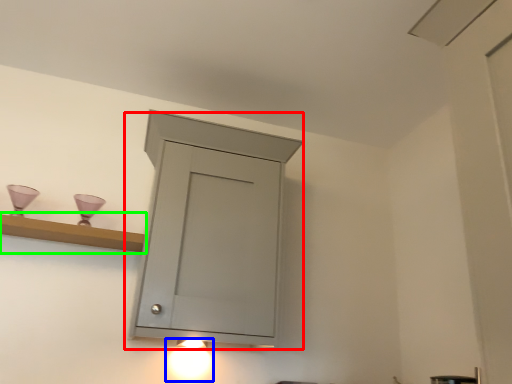
Question: Which object is positioned farthest from cupboard (highlighted by a red box)? Select from light fixture (highlighted by a blue box) and shelf (highlighted by a green box).

Choices:
 (A) light fixture
 (B) shelf

Answer: (A)